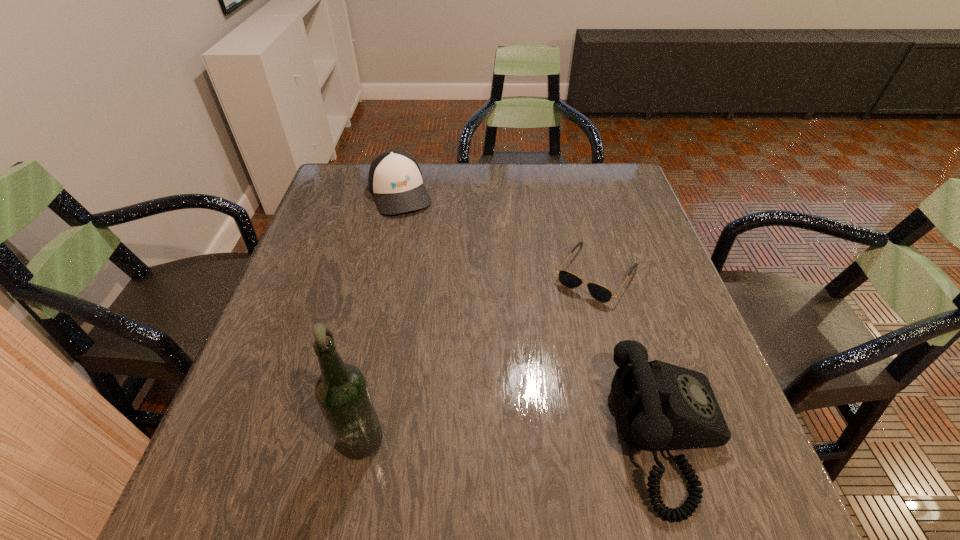
The height and width of the screenshot is (540, 960). What are the coordinates of `vacant space located on the front-facing side of the sunglasses` in the screenshot? It's located at (488, 434).

Identify the location of vacant region located 0.370m on the front-facing side of the sunglasses. (491, 430).

Locate an element on the screen. object that is at the far edge is located at coordinates (395, 180).

Image resolution: width=960 pixels, height=540 pixels. What are the coordinates of `beer bottle at the near edge` in the screenshot? It's located at (341, 391).

Image resolution: width=960 pixels, height=540 pixels. Identify the location of telephone that is positioned at the near edge. (661, 406).

Find the location of a particular element. The width and height of the screenshot is (960, 540). object that is at the left edge is located at coordinates [395, 180].

The image size is (960, 540). What are the coordinates of `telephone that is at the right edge` in the screenshot? It's located at (661, 406).

This screenshot has width=960, height=540. I want to click on sunglasses that is positioned at the right edge, so click(x=567, y=279).

Image resolution: width=960 pixels, height=540 pixels. What are the coordinates of `object that is at the far left corner` in the screenshot? It's located at 395,180.

Where is `object present at the near right corner`? The width and height of the screenshot is (960, 540). object present at the near right corner is located at coordinates (661, 406).